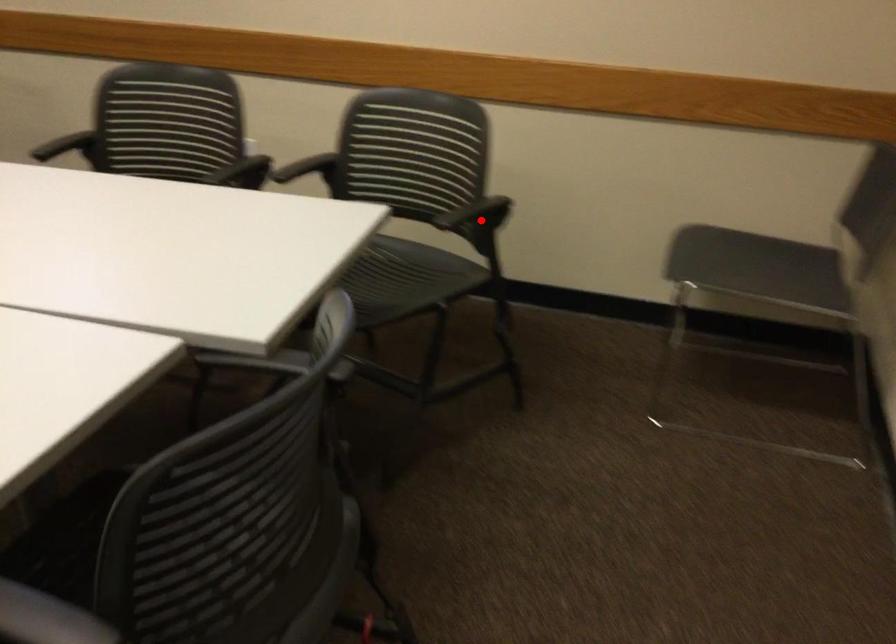
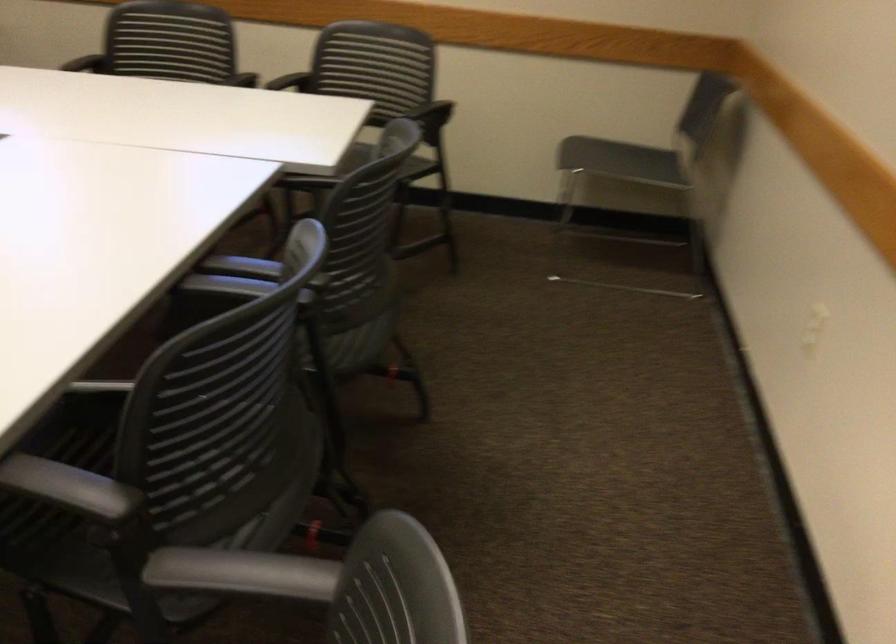
Question: I am providing you with two images of the same scene from different viewpoints. Image1 has a red point marked. In image2, the corresponding 3D location appears at what relative position? Reply with the corresponding letter.

Choices:
 (A) Closer
 (B) Farther

Answer: (B)